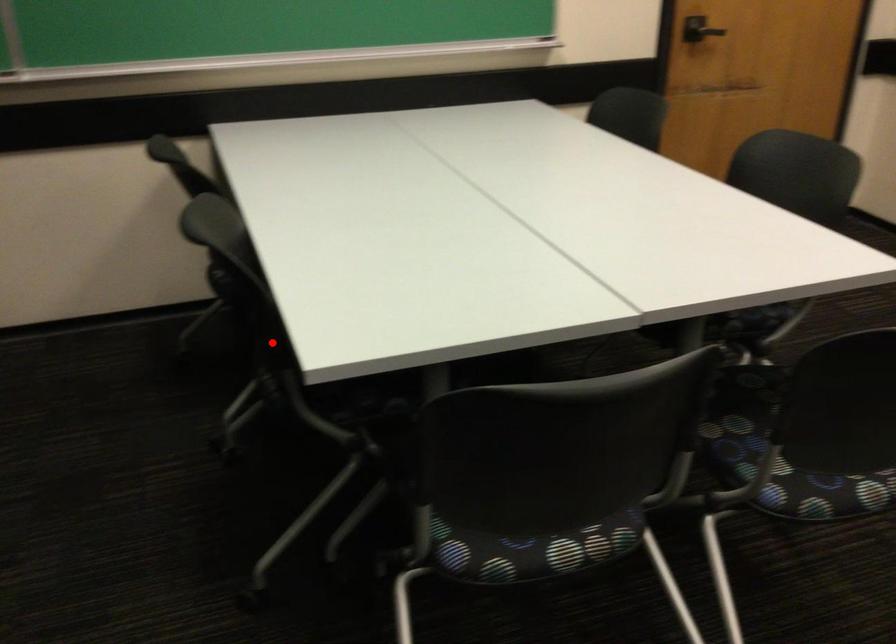
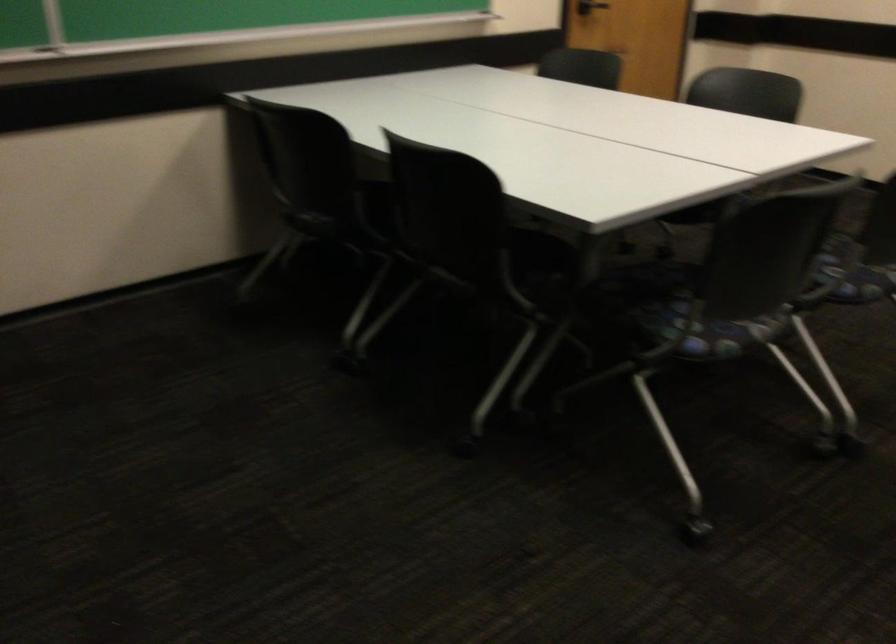
In the second image, find the point that corresponds to the highlighted location in the first image.

(455, 245)